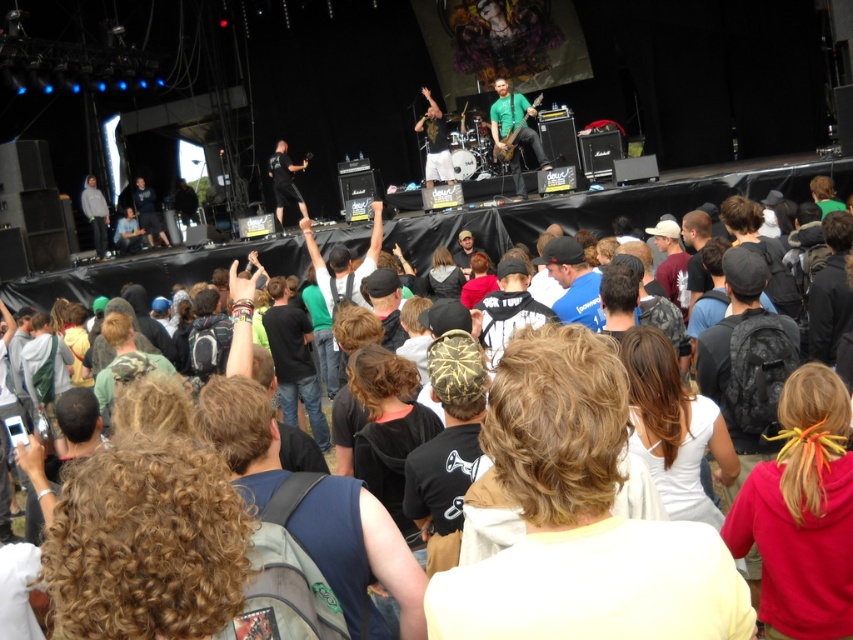
Question: Which object is positioned closest to the black matte pants at center?

Choices:
 (A) gray hoodie at left
 (B) green fabric shirt at center
 (C) green matte shirt at center
 (D) light yellow shirt at center

Answer: (B)

Question: Which object is closer to the camera taking this photo?

Choices:
 (A) black matte pants at center
 (B) red hoodie at center
 (C) light yellow shirt at center
 (D) green matte shirt at center

Answer: (C)

Question: Among these points, which one is nearest to the camera?

Choices:
 (A) (444, 176)
 (B) (689, 632)
 (C) (96, 218)
 (D) (527, 141)

Answer: (B)

Question: Is black matte pants at center bigger than gray hoodie at left?

Choices:
 (A) no
 (B) yes

Answer: (B)

Question: Can you confirm if red hoodie at center is thinner than green fabric shirt at center?

Choices:
 (A) no
 (B) yes

Answer: (B)

Question: Does red hoodie at center have a greater width compared to green matte shirt at center?

Choices:
 (A) no
 (B) yes

Answer: (A)